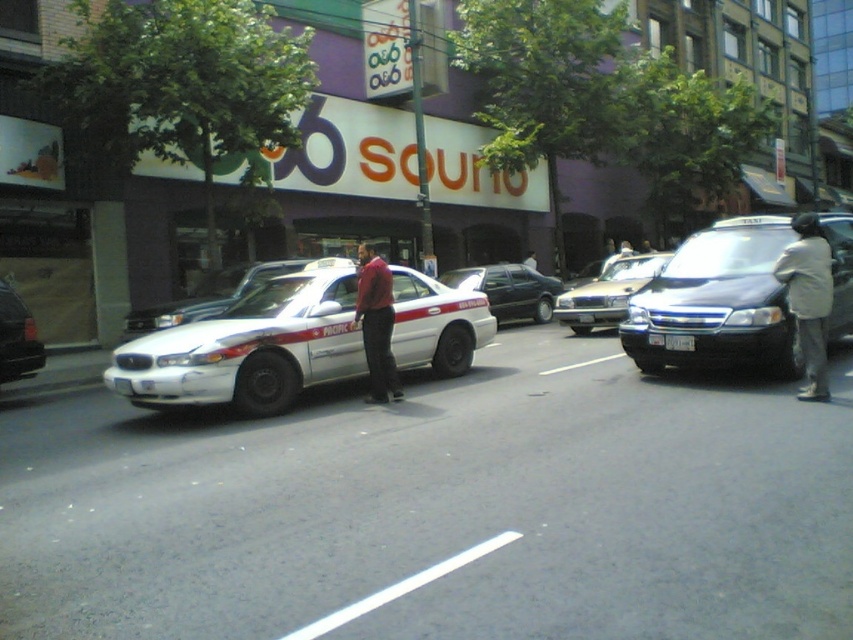
Question: Among these objects, which one is nearest to the camera?

Choices:
 (A) silver metallic sedan at center
 (B) white glossy sedan at center
 (C) shiny black sedan at center right
 (D) white glossy taxi cab at left

Answer: (C)

Question: Among these objects, which one is farthest from the camera?

Choices:
 (A) silver metallic sedan at center
 (B) light beige jacket at right

Answer: (A)

Question: Which of the following is the farthest from the observer?

Choices:
 (A) (529, 250)
 (B) (619, 317)
 (C) (387, 355)
 (D) (674, 344)

Answer: (A)

Question: Does gold metallic sedan at center appear on the left side of white plastic license plate at center?

Choices:
 (A) yes
 (B) no

Answer: (B)

Question: Can you confirm if white glossy taxi cab at left is positioned to the left of gold metallic sedan at center?

Choices:
 (A) yes
 (B) no

Answer: (A)

Question: From the image, what is the correct spatial relationship of light beige jacket at right in relation to silver metallic sedan at center?

Choices:
 (A) right
 (B) left

Answer: (A)